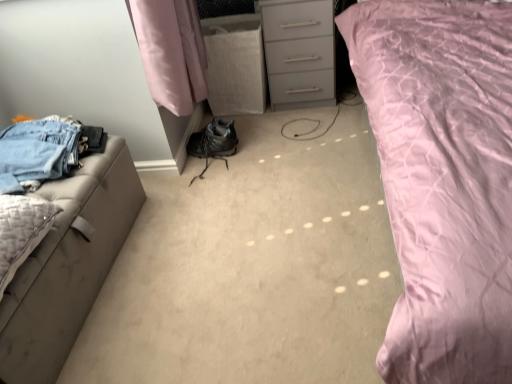
Question: From a real-world perspective, is textured beige pillow at left on denim jeans at left?

Choices:
 (A) yes
 (B) no

Answer: (B)

Question: Considering the relative sizes of textured beige pillow at left and denim jeans at left in the image provided, is textured beige pillow at left smaller than denim jeans at left?

Choices:
 (A) no
 (B) yes

Answer: (B)

Question: Are textured beige pillow at left and denim jeans at left located far from each other?

Choices:
 (A) no
 (B) yes

Answer: (A)

Question: Is textured beige pillow at left with denim jeans at left?

Choices:
 (A) yes
 (B) no

Answer: (B)

Question: Could you tell me if textured beige pillow at left is facing denim jeans at left?

Choices:
 (A) yes
 (B) no

Answer: (B)

Question: From a real-world perspective, is pink quilted fabric at upper right physically located above or below leatherette ottoman at left?

Choices:
 (A) below
 (B) above

Answer: (B)

Question: Is pink quilted fabric at upper right taller or shorter than leatherette ottoman at left?

Choices:
 (A) short
 (B) tall

Answer: (B)

Question: Relative to leatherette ottoman at left, is pink quilted fabric at upper right in front or behind?

Choices:
 (A) front
 (B) behind

Answer: (A)

Question: Visually, is pink quilted fabric at upper right positioned to the left or to the right of leatherette ottoman at left?

Choices:
 (A) right
 (B) left

Answer: (A)

Question: Does point (66, 236) appear closer or farther from the camera than point (387, 91)?

Choices:
 (A) closer
 (B) farther

Answer: (A)

Question: In the image, is leatherette ottoman at left positioned in front of or behind pink quilted fabric at upper right?

Choices:
 (A) behind
 (B) front

Answer: (A)

Question: Based on their sizes in the image, would you say leatherette ottoman at left is bigger or smaller than pink quilted fabric at upper right?

Choices:
 (A) small
 (B) big

Answer: (A)

Question: Considering the positions of leatherette ottoman at left and pink quilted fabric at upper right in the image, is leatherette ottoman at left wider or thinner than pink quilted fabric at upper right?

Choices:
 (A) thin
 (B) wide

Answer: (A)

Question: Considering the relative positions of leatherette ottoman at left and textured beige pillow at left in the image provided, is leatherette ottoman at left to the left or to the right of textured beige pillow at left?

Choices:
 (A) right
 (B) left

Answer: (B)

Question: Considering the positions of leatherette ottoman at left and textured beige pillow at left in the image, is leatherette ottoman at left taller or shorter than textured beige pillow at left?

Choices:
 (A) short
 (B) tall

Answer: (B)